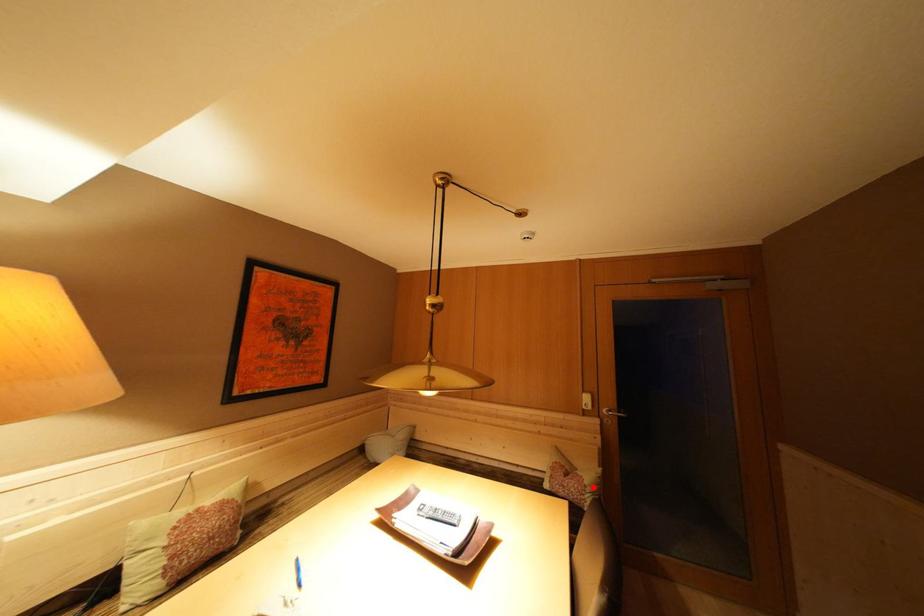
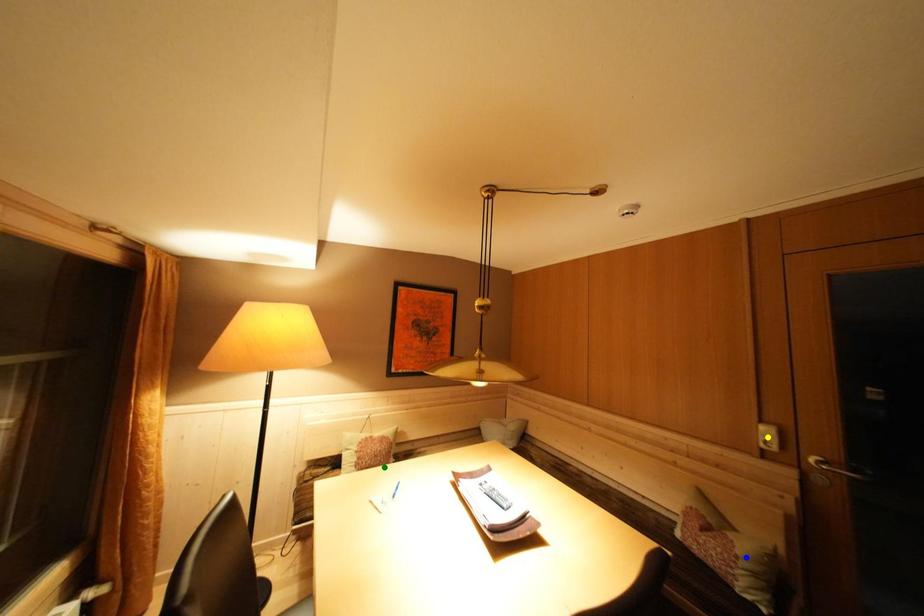
Question: I am providing you with two images of the same scene from different viewpoints. A red point is marked on the first image. You are given multiple points on the second image. Which point in image 2 represents the same 3d spot as the red point in image 1?

Choices:
 (A) yellow point
 (B) green point
 (C) blue point

Answer: (C)